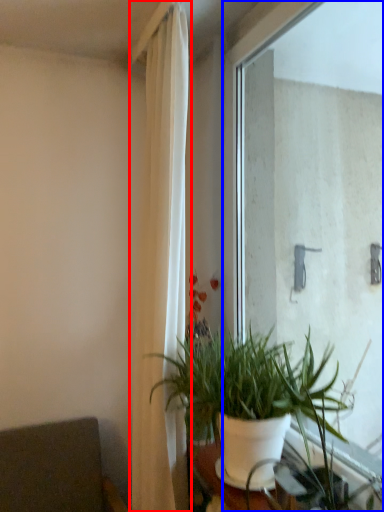
Question: Which object appears closest to the camera in this image, curtain (highlighted by a red box) or window (highlighted by a blue box)?

Choices:
 (A) curtain
 (B) window

Answer: (B)